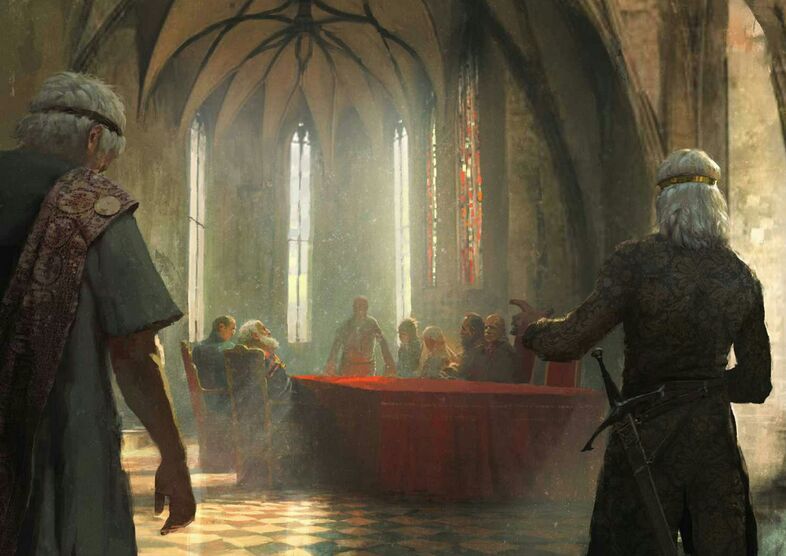
I want to click on table, so click(446, 416).